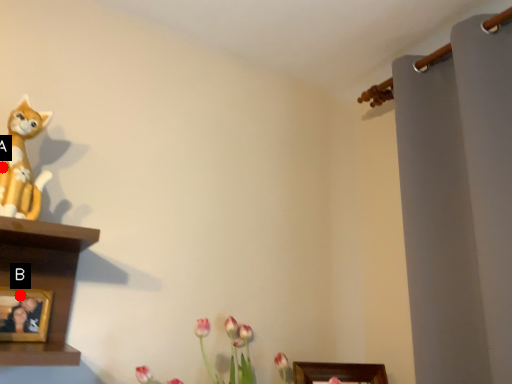
Question: Two points are circled on the image, labeled by A and B beside each circle. Among these points, which one is farthest from the camera?

Choices:
 (A) A is further
 (B) B is further

Answer: (B)